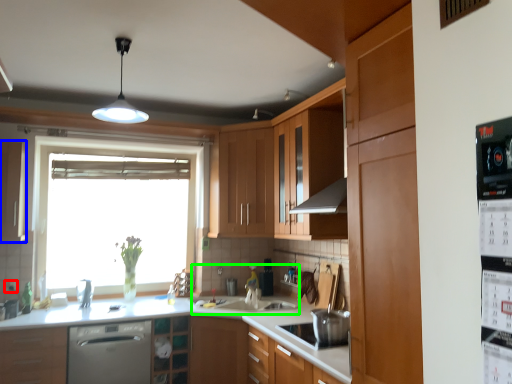
Question: Which object is the farthest from electric outlet (highlighted by a red box)? Choose among these: cabinetry (highlighted by a blue box) or sink (highlighted by a green box).

Choices:
 (A) cabinetry
 (B) sink

Answer: (B)